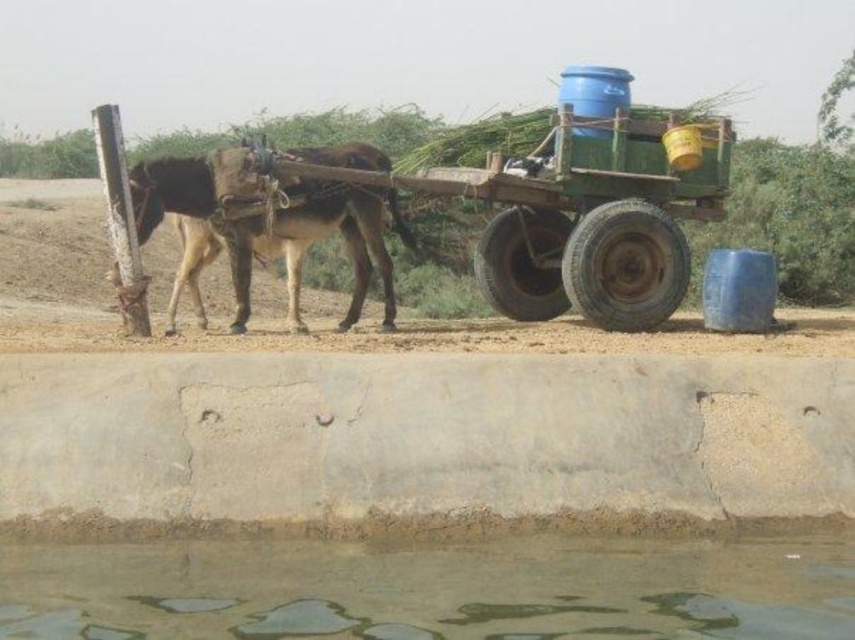
You are standing at the point with coordinates point (433, 588) in the rural scene. What do you see directly in front of you?

At point (433, 588), you see clear water at lower center directly in front of you.

You are a traveler who needs to cross a shallow stream in the middle of a dirt path. The stream is represented by the clear water at lower center. The brown rough donkey at left is currently pulling a cart. Can the donkey and cart safely cross the stream without getting stuck?

The clear water at lower center has a lesser height compared to the brown rough donkey at left, meaning the stream is not deep enough to pose a problem. The donkey and cart can safely cross the stream without getting stuck.